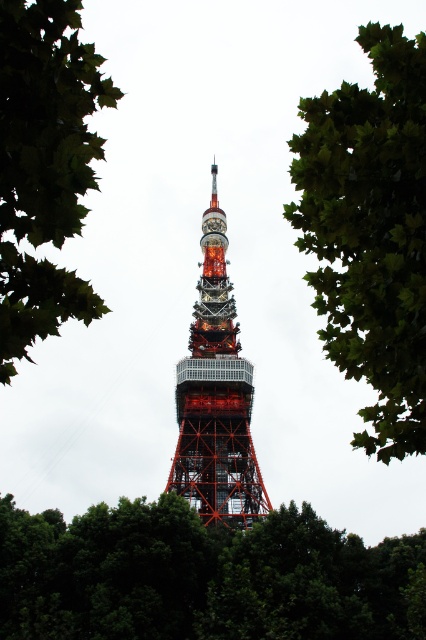
What do you see at coordinates (371, 232) in the screenshot? I see `green leafy tree at upper center` at bounding box center [371, 232].

Can you confirm if green leafy tree at upper center is shorter than shiny metallic tower at center?

No.

Identify the location of green leafy tree at upper center. The image size is (426, 640). (371, 232).

Between green leafy tree at center and green leafy tree at upper center, which one has more height?

With more height is green leafy tree at upper center.

Between point (224, 627) and point (382, 26), which one is positioned behind?

The point (382, 26) is behind.

Is point (166, 529) closer to camera compared to point (411, 195)?

No, (166, 529) is further to viewer.

Identify the location of green leafy tree at center. (201, 577).

From the picture: Can you confirm if green leafy tree at center is smaller than shiny metallic tower at center?

Correct, green leafy tree at center occupies less space than shiny metallic tower at center.

Locate an element on the screen. green leafy tree at center is located at coordinates (201, 577).

Locate an element on the screen. green leafy tree at center is located at coordinates (201, 577).